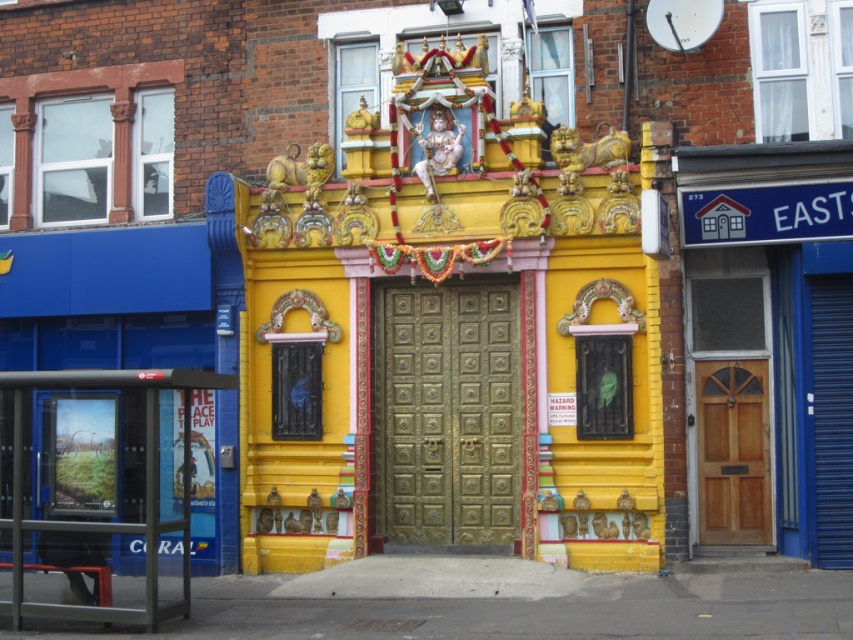
Question: Is gold textured door at center positioned in front of wooden door at center?

Choices:
 (A) yes
 (B) no

Answer: (B)

Question: Which of the following is the farthest from the observer?

Choices:
 (A) gold textured door at center
 (B) metallic bus stop at lower left

Answer: (A)

Question: Is metallic bus stop at lower left positioned at the back of wooden door at center?

Choices:
 (A) no
 (B) yes

Answer: (A)

Question: Does gold textured door at center have a lesser width compared to metallic bus stop at lower left?

Choices:
 (A) yes
 (B) no

Answer: (A)

Question: Which point is closer to the camera?

Choices:
 (A) (4, 605)
 (B) (387, 426)
 (C) (735, 392)

Answer: (A)

Question: Which of the following is the farthest from the observer?

Choices:
 (A) (730, 392)
 (B) (473, 449)
 (C) (102, 589)

Answer: (B)